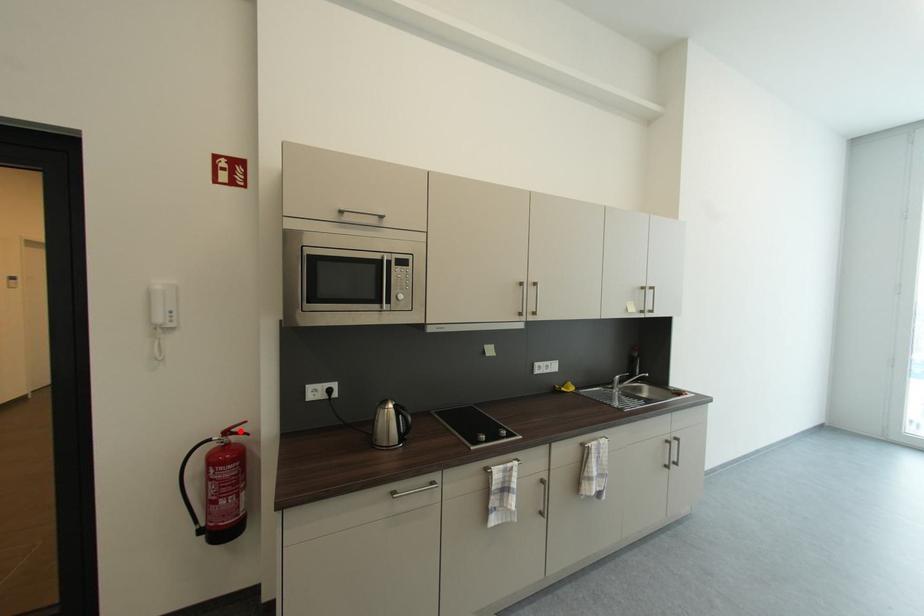
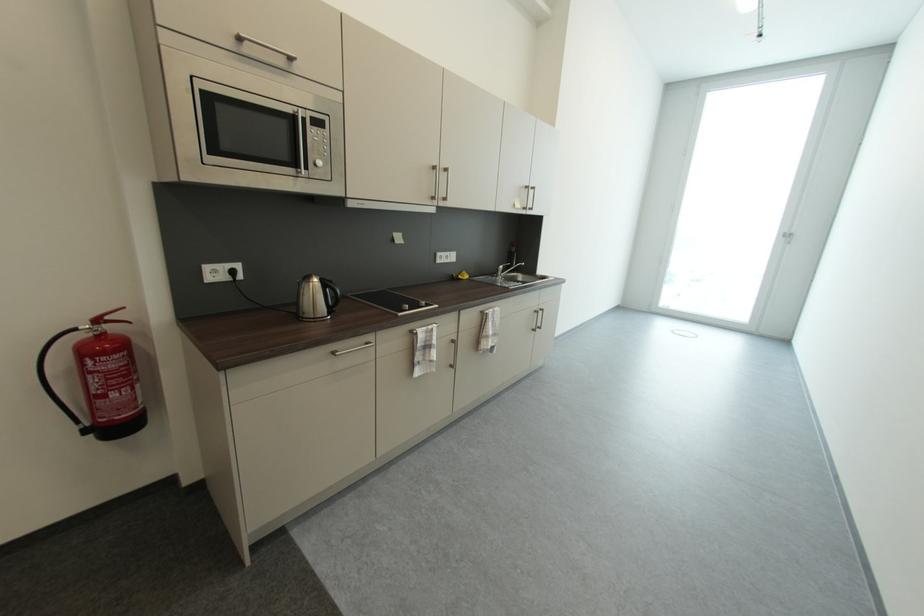
Locate, in the second image, the point that corresponds to the highlighted location in the first image.

(116, 318)